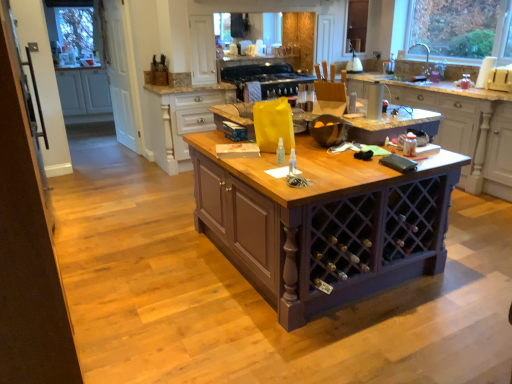
Where is `free location in front of purple wood table at center`? The image size is (512, 384). free location in front of purple wood table at center is located at coordinates (327, 333).